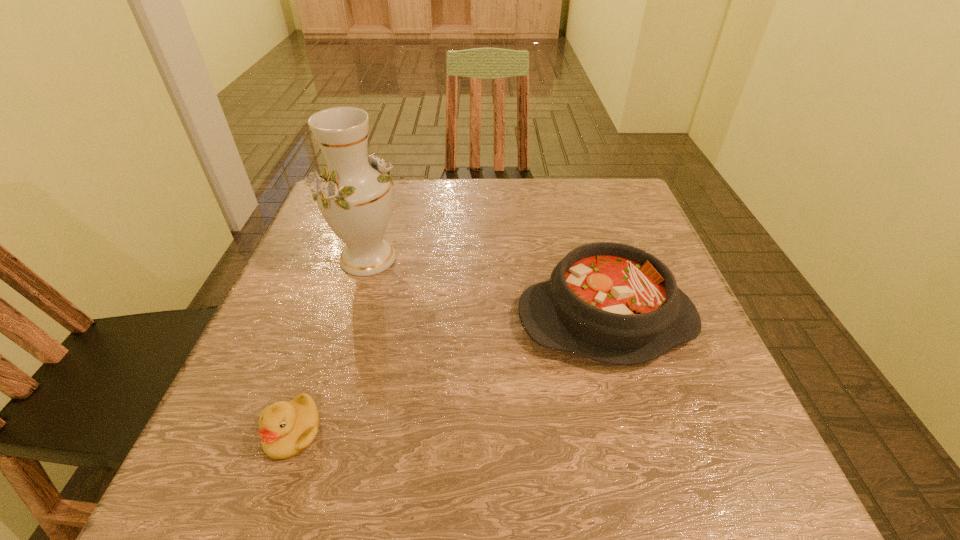
Find the location of a particular element. The height and width of the screenshot is (540, 960). blank region between the second tallest object and the duckling is located at coordinates (449, 376).

The image size is (960, 540). I want to click on free space between the vase and the duckling, so click(330, 345).

Image resolution: width=960 pixels, height=540 pixels. Find the location of `vacant area that lies between the vase and the duckling`. vacant area that lies between the vase and the duckling is located at coordinates (330, 345).

Where is `vacant point located between the shortest object and the tallest object`? vacant point located between the shortest object and the tallest object is located at coordinates (330, 345).

Where is `vacant area that lies between the rightmost object and the duckling`? The width and height of the screenshot is (960, 540). vacant area that lies between the rightmost object and the duckling is located at coordinates (449, 376).

The image size is (960, 540). What are the coordinates of `empty location between the rightmost object and the tallest object` in the screenshot? It's located at (487, 289).

Locate an element on the screen. This screenshot has width=960, height=540. free point between the shortest object and the second tallest object is located at coordinates point(449,376).

At what (x,y) coordinates should I click in order to perform the action: click on empty location between the duckling and the vase. Please return your answer as a coordinate pair (x, y). The height and width of the screenshot is (540, 960). Looking at the image, I should click on (330, 345).

Where is `vacant region between the tallest object and the duckling`? This screenshot has height=540, width=960. vacant region between the tallest object and the duckling is located at coordinates (330, 345).

What are the coordinates of `free space that is in between the vase and the shortest object` in the screenshot? It's located at (330, 345).